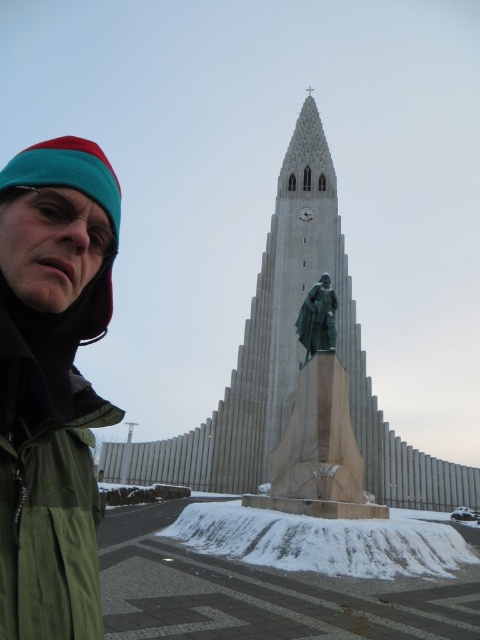
Question: In this image, where is light gray stone tower at center located relative to green polished statue at center?

Choices:
 (A) below
 (B) above

Answer: (B)

Question: Can you confirm if green polished statue at center is smaller than bronze statue at center?

Choices:
 (A) yes
 (B) no

Answer: (B)

Question: Considering the relative positions of light gray stone tower at center and green matte jacket at lower left in the image provided, where is light gray stone tower at center located with respect to green matte jacket at lower left?

Choices:
 (A) right
 (B) left

Answer: (A)

Question: Among these points, which one is farthest from the camera?

Choices:
 (A) (388, 456)
 (B) (311, 369)

Answer: (A)

Question: Which object appears farthest from the camera in this image?

Choices:
 (A) green polished statue at center
 (B) green matte jacket at lower left
 (C) bronze statue at center
 (D) light gray stone tower at center

Answer: (D)

Question: Which object is farther from the camera taking this photo?

Choices:
 (A) bronze statue at center
 (B) green polished statue at center
 (C) light gray stone tower at center
 (D) green matte jacket at lower left

Answer: (C)